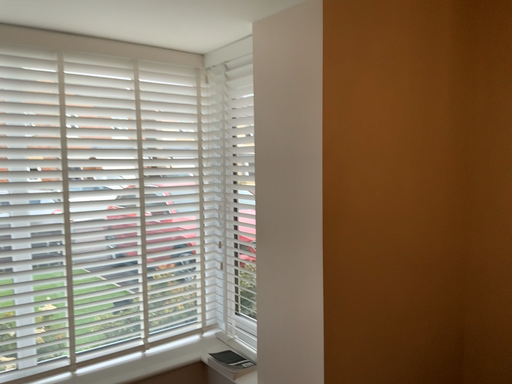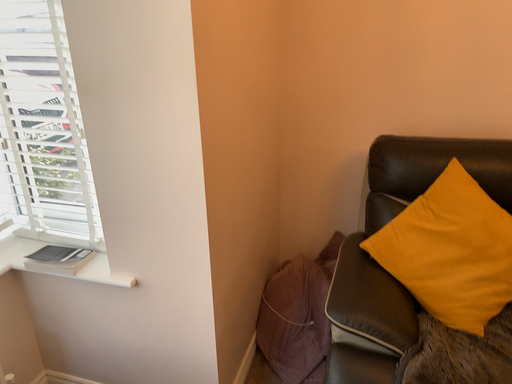
Question: How did the camera likely rotate when shooting the video?

Choices:
 (A) rotated upward
 (B) rotated downward

Answer: (B)